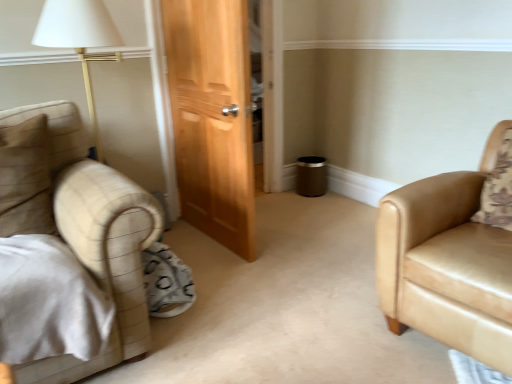
In order to face tan leather armchair at right, should I rotate leftwards or rightwards?

Turn right by 29.627 degrees to look at tan leather armchair at right.

What do you see at coordinates (448, 263) in the screenshot? I see `tan leather armchair at right` at bounding box center [448, 263].

The width and height of the screenshot is (512, 384). What are the coordinates of `tan leather armchair at right` in the screenshot? It's located at (448, 263).

At what (x,y) coordinates should I click in order to perform the action: click on beige fabric pillow at left. Please return your answer as a coordinate pair (x, y). Image resolution: width=512 pixels, height=384 pixels. Looking at the image, I should click on (25, 179).

What do you see at coordinates (25, 179) in the screenshot?
I see `beige fabric pillow at left` at bounding box center [25, 179].

Locate an element on the screen. tan leather armchair at right is located at coordinates (448, 263).

Can you confirm if beige fabric pillow at left is positioned to the left of tan leather armchair at right?

Indeed, beige fabric pillow at left is positioned on the left side of tan leather armchair at right.

Does beige fabric pillow at left lie behind tan leather armchair at right?

Yes, it is behind tan leather armchair at right.

Between point (3, 147) and point (462, 309), which one is positioned behind?

The point (3, 147) is behind.

From the image's perspective, is beige fabric pillow at left positioned above or below tan leather armchair at right?

beige fabric pillow at left is situated higher than tan leather armchair at right in the image.

From a real-world perspective, which is physically below, beige fabric pillow at left or tan leather armchair at right?

tan leather armchair at right is physically lower.

Between beige fabric pillow at left and tan leather armchair at right, which one has smaller width?

Thinner between the two is beige fabric pillow at left.

In terms of height, does beige fabric pillow at left look taller or shorter compared to tan leather armchair at right?

In the image, beige fabric pillow at left appears to be shorter than tan leather armchair at right.

Which of these two, beige fabric pillow at left or tan leather armchair at right, is bigger?

Bigger between the two is tan leather armchair at right.

Do you think beige fabric pillow at left is within tan leather armchair at right, or outside of it?

The correct answer is: outside.

Are beige fabric pillow at left and tan leather armchair at right located far from each other?

That's right, there is a large distance between beige fabric pillow at left and tan leather armchair at right.

Is beige fabric pillow at left oriented away from tan leather armchair at right?

No, beige fabric pillow at left's orientation is not away from tan leather armchair at right.

Can you tell me how much beige fabric pillow at left and tan leather armchair at right differ in facing direction?

There is a 76.9-degree angle between the facing directions of beige fabric pillow at left and tan leather armchair at right.

This screenshot has height=384, width=512. Identify the location of chair lying below the beige fabric pillow at left (from the image's perspective). (448, 263).

Does tan leather armchair at right appear on the left side of beige fabric pillow at left?

No.

Considering the positions of objects tan leather armchair at right and beige fabric pillow at left in the image provided, who is behind, tan leather armchair at right or beige fabric pillow at left?

beige fabric pillow at left.

Is point (511, 259) in front of point (25, 173)?

Yes, it is.

From the image's perspective, which object appears higher, tan leather armchair at right or beige fabric pillow at left?

beige fabric pillow at left appears higher in the image.

From a real-world perspective, who is located lower, tan leather armchair at right or beige fabric pillow at left?

In real-world perspective, tan leather armchair at right is lower.

Looking at their sizes, would you say tan leather armchair at right is wider or thinner than beige fabric pillow at left?

In the image, tan leather armchair at right appears to be wider than beige fabric pillow at left.

Considering the relative sizes of tan leather armchair at right and beige fabric pillow at left in the image provided, is tan leather armchair at right taller than beige fabric pillow at left?

Yes, tan leather armchair at right is taller than beige fabric pillow at left.

Considering the sizes of objects tan leather armchair at right and beige fabric pillow at left in the image provided, who is bigger, tan leather armchair at right or beige fabric pillow at left?

tan leather armchair at right.

Is tan leather armchair at right completely or partially outside of beige fabric pillow at left?

Yes, tan leather armchair at right is not within beige fabric pillow at left.

Can you see tan leather armchair at right touching beige fabric pillow at left?

tan leather armchair at right is not next to beige fabric pillow at left, and they're not touching.

Does tan leather armchair at right turn towards beige fabric pillow at left?

No, tan leather armchair at right is not turned towards beige fabric pillow at left.

I want to click on chair in front of the beige fabric pillow at left, so click(x=448, y=263).

The image size is (512, 384). In the image, there is a tan leather armchair at right. Find the location of `pillow above it (from the image's perspective)`. pillow above it (from the image's perspective) is located at coordinates (25, 179).

What are the coordinates of `chair that appears below the beige fabric pillow at left (from the image's perspective)` in the screenshot? It's located at (448, 263).